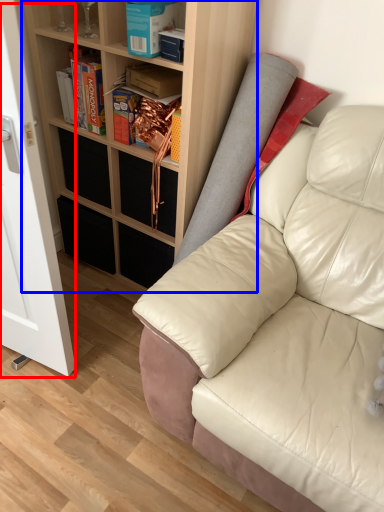
Question: Which of the following is the closest to the observer, glass door (highlighted by a red box) or shelf (highlighted by a blue box)?

Choices:
 (A) glass door
 (B) shelf

Answer: (A)